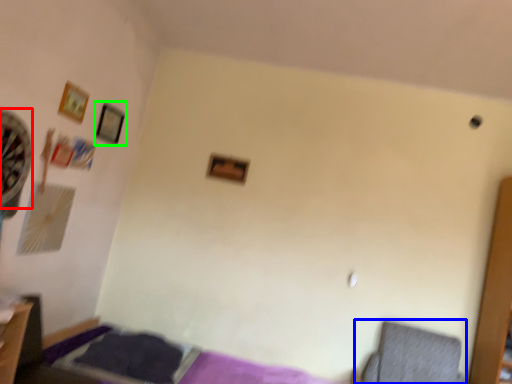
Question: Based on their relative distances, which object is nearer to fan (highlighted by a red box)? Choose from swivel chair (highlighted by a blue box) and picture frame (highlighted by a green box).

Choices:
 (A) swivel chair
 (B) picture frame

Answer: (B)